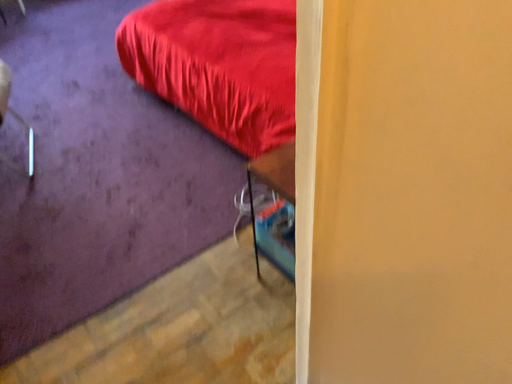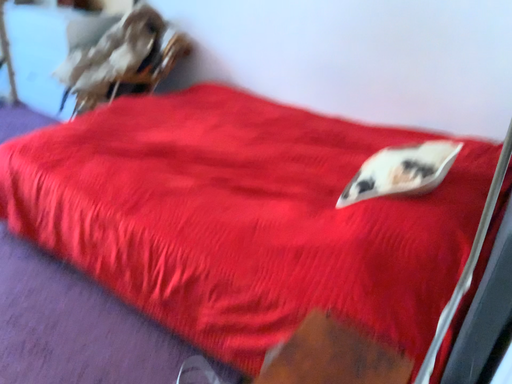
Question: Which way did the camera rotate in the video?

Choices:
 (A) rotated downward
 (B) rotated upward

Answer: (B)